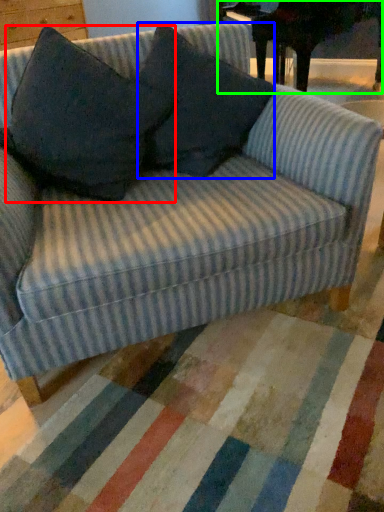
Question: Which object is positioned farthest from throw pillow (highlighted by a red box)? Select from throw pillow (highlighted by a blue box) and table (highlighted by a green box).

Choices:
 (A) throw pillow
 (B) table

Answer: (B)